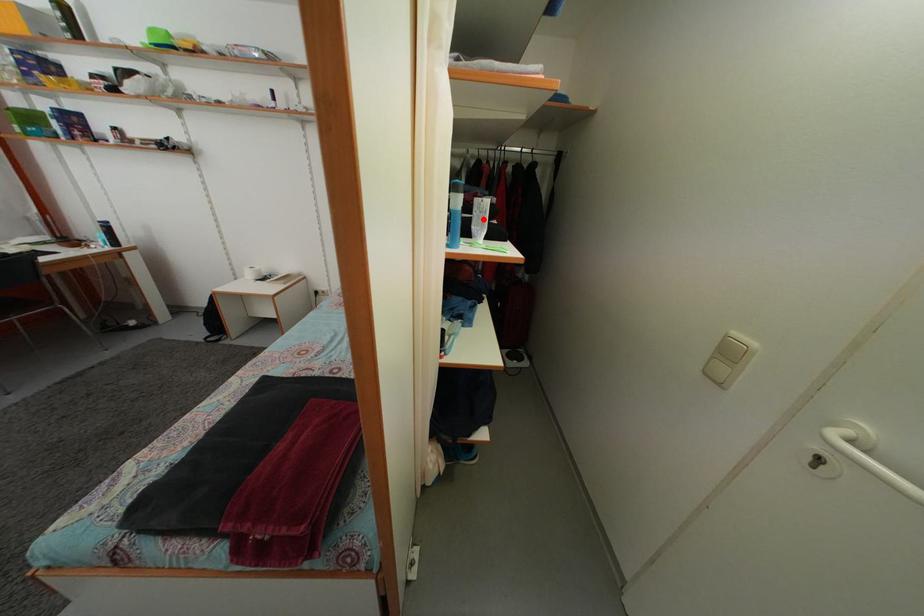
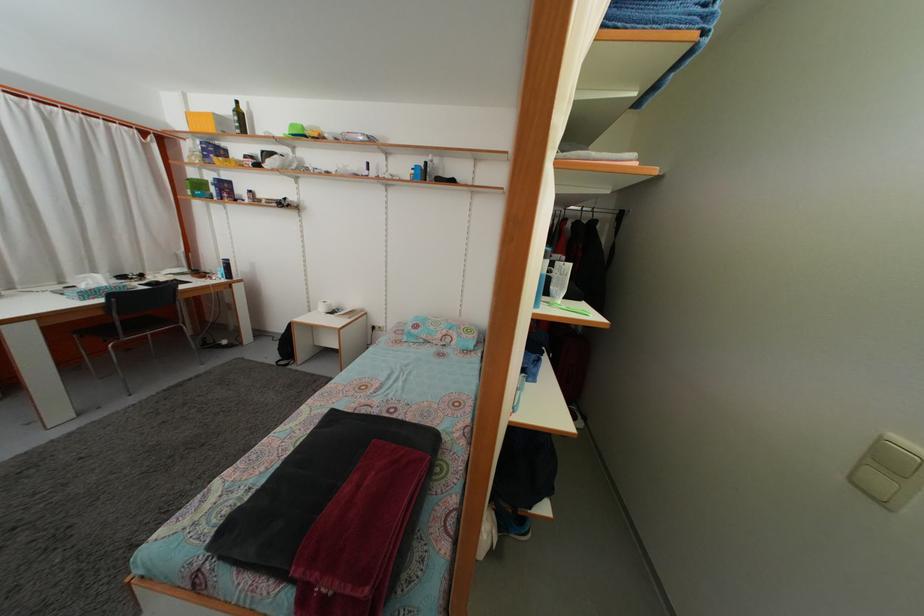
Question: I am providing you with two images of the same scene from different viewpoints. A red point is marked on the first image. At the location where the point appears in image 1, is it still visible in image 2?

Choices:
 (A) Yes
 (B) No

Answer: (A)